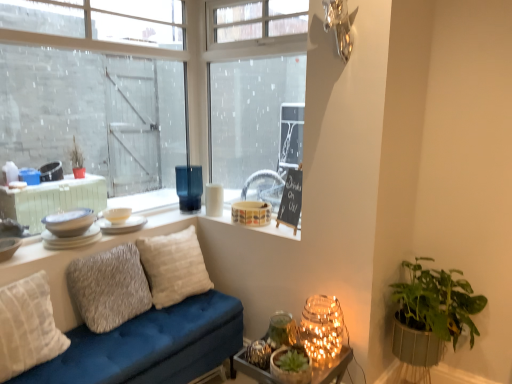
What is the approximate width of matte white plate at upper left, the second tableware viewed from the back?

matte white plate at upper left, the second tableware viewed from the back, is 25.85 centimeters wide.

In order to face textured gray pillow at center, positioned as the 2th pillow in front-to-back order, should I rotate leftwards or rightwards?

Rotate left and turn 18.569 degrees.

The image size is (512, 384). What do you see at coordinates (251, 213) in the screenshot?
I see `matte ceramic bowl at upper center, positioned as the 1th candle holder in right-to-left order` at bounding box center [251, 213].

What do you see at coordinates (214, 200) in the screenshot?
I see `white matte candle holder at upper center, the second candle holder positioned from the left` at bounding box center [214, 200].

The height and width of the screenshot is (384, 512). What do you see at coordinates (145, 100) in the screenshot?
I see `transparent glass window at upper left, arranged as the 2th window when ordered from the bottom` at bounding box center [145, 100].

You are a GUI agent. You are given a task and a screenshot of the screen. Output one action in this format:
    pyautogui.click(x=<x>, y=<y>)
    Task: Click on the matte white plate at upper left, which appears as the third tableware when viewed from the front
    Image resolution: width=512 pixels, height=384 pixels.
    Given the screenshot: What is the action you would take?
    click(x=122, y=225)

Is beige textured pillow at center, the 3th pillow from the front, wider than black chalkboard at upper center?

Correct, the width of beige textured pillow at center, the 3th pillow from the front, exceeds that of black chalkboard at upper center.

Is point (145, 247) positioned after point (283, 189)?

That is False.

How different are the orientations of beige textured pillow at center, the 3th pillow from the front, and black chalkboard at upper center in degrees?

The facing directions of beige textured pillow at center, the 3th pillow from the front, and black chalkboard at upper center are 113 degrees apart.

Is matte white plates at window sill, marked as the fourth tableware in a back-to-front arrangement, to the left or to the right of green textured pot at lower right, positioned as the first houseplant in left-to-right order, in the image?

In the image, matte white plates at window sill, marked as the fourth tableware in a back-to-front arrangement, appears on the left side of green textured pot at lower right, positioned as the first houseplant in left-to-right order.

Is matte white plates at window sill, the first tableware in the front-to-back sequence, far from green textured pot at lower right, positioned as the first houseplant in left-to-right order?

Absolutely, matte white plates at window sill, the first tableware in the front-to-back sequence, is distant from green textured pot at lower right, positioned as the first houseplant in left-to-right order.

Is matte white plates at window sill, the first tableware in the front-to-back sequence, facing towards green textured pot at lower right, the 2th houseplant when ordered from right to left?

No, matte white plates at window sill, the first tableware in the front-to-back sequence, is not facing towards green textured pot at lower right, the 2th houseplant when ordered from right to left.

Considering their positions, is matte white plates at window sill, the first tableware in the front-to-back sequence, located in front of or behind green textured pot at lower right, positioned as the first houseplant in left-to-right order?

Clearly, matte white plates at window sill, the first tableware in the front-to-back sequence, is behind green textured pot at lower right, positioned as the first houseplant in left-to-right order.

Is white glossy bowls at upper left, the 3th tableware positioned from the back, completely or partially outside of green textured pot at lower right, the 2th houseplant when ordered from right to left?

Yes, white glossy bowls at upper left, the 3th tableware positioned from the back, is located beyond the bounds of green textured pot at lower right, the 2th houseplant when ordered from right to left.

Which is behind, point (52, 246) or point (288, 372)?

The point (52, 246) is farther.

Looking at this image, is green textured pot at lower right, the 2th houseplant when ordered from right to left, at the back of white glossy bowls at upper left, which appears as the 2th tableware when viewed from the front?

white glossy bowls at upper left, which appears as the 2th tableware when viewed from the front, is not turned away from green textured pot at lower right, the 2th houseplant when ordered from right to left.

Is the surface of black chalkboard at upper center in direct contact with beige textured pillow at center, the 1th pillow when ordered from back to front?

No, black chalkboard at upper center is not next to beige textured pillow at center, the 1th pillow when ordered from back to front.

Which of these two, black chalkboard at upper center or beige textured pillow at center, the 1th pillow when ordered from back to front, stands taller?

black chalkboard at upper center is taller.

Is black chalkboard at upper center completely or partially outside of beige textured pillow at center, the 1th pillow when ordered from back to front?

black chalkboard at upper center lies outside beige textured pillow at center, the 1th pillow when ordered from back to front,'s area.

From the image's perspective, which object appears higher, black chalkboard at upper center or beige textured pillow at center, the 1th pillow when ordered from back to front?

black chalkboard at upper center.

From the image's perspective, which object appears higher, white matte bowl at upper center, the first tableware positioned from the back, or transparent glass window at upper left, arranged as the 2th window when ordered from the bottom?

transparent glass window at upper left, arranged as the 2th window when ordered from the bottom, is shown above in the image.

Is white matte bowl at upper center, the fourth tableware positioned from the front, far from transparent glass window at upper left, arranged as the 2th window when ordered from the bottom?

No.

Which object is closer to the camera, white matte bowl at upper center, the fourth tableware positioned from the front, or transparent glass window at upper left, arranged as the 1th window when viewed from the top?

transparent glass window at upper left, arranged as the 1th window when viewed from the top, is closer to the camera.

Measure the distance from white matte bowl at upper center, the first tableware positioned from the back, to transparent glass window at upper left, arranged as the 1th window when viewed from the top.

white matte bowl at upper center, the first tableware positioned from the back, is 82.97 centimeters from transparent glass window at upper left, arranged as the 1th window when viewed from the top.

Considering the sizes of objects matte white plate at upper left, which appears as the third tableware when viewed from the front, and matte ceramic bowl at upper center, marked as the 3th candle holder in a left-to-right arrangement, in the image provided, who is bigger, matte white plate at upper left, which appears as the third tableware when viewed from the front, or matte ceramic bowl at upper center, marked as the 3th candle holder in a left-to-right arrangement,?

With larger size is matte ceramic bowl at upper center, marked as the 3th candle holder in a left-to-right arrangement.

Consider the image. Does matte white plate at upper left, the second tableware viewed from the back, lie in front of matte ceramic bowl at upper center, marked as the 3th candle holder in a left-to-right arrangement?

Yes, it is.

At what (x,y) coordinates should I click in order to perform the action: click on the 1st tableware counting from the left of the matte ceramic bowl at upper center, marked as the 3th candle holder in a left-to-right arrangement. Please return your answer as a coordinate pair (x, y). The height and width of the screenshot is (384, 512). Looking at the image, I should click on tap(122, 225).

Is there a large distance between matte white plate at upper left, which appears as the third tableware when viewed from the front, and matte ceramic bowl at upper center, positioned as the 1th candle holder in right-to-left order?

That's not correct — matte white plate at upper left, which appears as the third tableware when viewed from the front, is a little close to matte ceramic bowl at upper center, positioned as the 1th candle holder in right-to-left order.

Is translucent glass vase at window, placed as the 1th candle holder when sorted from left to right, surrounded by white matte bowl at upper center, the fourth tableware positioned from the front?

No.

Based on the photo, considering the relative sizes of white matte bowl at upper center, the first tableware positioned from the back, and translucent glass vase at window, placed as the 1th candle holder when sorted from left to right, in the image provided, is white matte bowl at upper center, the first tableware positioned from the back, thinner than translucent glass vase at window, placed as the 1th candle holder when sorted from left to right,?

No, white matte bowl at upper center, the first tableware positioned from the back, is not thinner than translucent glass vase at window, placed as the 1th candle holder when sorted from left to right.

Considering the sizes of objects white matte bowl at upper center, the first tableware positioned from the back, and translucent glass vase at window, placed as the 1th candle holder when sorted from left to right, in the image provided, who is shorter, white matte bowl at upper center, the first tableware positioned from the back, or translucent glass vase at window, placed as the 1th candle holder when sorted from left to right,?

white matte bowl at upper center, the first tableware positioned from the back.

Which is behind, point (127, 213) or point (182, 183)?

The point (182, 183) is farther.

From the image's perspective, starting from the black chalkboard at upper center, which pillow is the 1st one below? Please provide its 2D coordinates.

[(173, 267)]

Identify the location of the 2nd houseplant in front of the matte white plates at window sill, marked as the fourth tableware in a back-to-front arrangement. (290, 366).

Which object lies further to the anchor point matte white plates at window sill, marked as the fourth tableware in a back-to-front arrangement, white ceramic dishes at upper left, the first window positioned from the bottom, or white matte bowl at upper center, the fourth tableware positioned from the front?

white ceramic dishes at upper left, the first window positioned from the bottom, lies further to matte white plates at window sill, marked as the fourth tableware in a back-to-front arrangement, than the other object.

Which object lies further to the anchor point textured gray pillow at center, marked as the 2th pillow in a back-to-front arrangement, green textured pot at lower right, positioned as the first houseplant in left-to-right order, or matte white plates at window sill, marked as the fourth tableware in a back-to-front arrangement?

Among the two, green textured pot at lower right, positioned as the first houseplant in left-to-right order, is located further to textured gray pillow at center, marked as the 2th pillow in a back-to-front arrangement.

From the image, which object appears to be farther from transparent glass window at upper left, arranged as the 1th window when viewed from the top, matte white plate at upper left, which appears as the third tableware when viewed from the front, or matte ceramic bowl at upper center, positioned as the 1th candle holder in right-to-left order?

matte ceramic bowl at upper center, positioned as the 1th candle holder in right-to-left order, lies further to transparent glass window at upper left, arranged as the 1th window when viewed from the top, than the other object.

From the image, which object appears to be farther from textured gray pillow at center, marked as the 2th pillow in a back-to-front arrangement, white matte candle holder at upper center, the second candle holder positioned from the left, or beige textured pillow at center, the 1th pillow when ordered from back to front?

white matte candle holder at upper center, the second candle holder positioned from the left, is further to textured gray pillow at center, marked as the 2th pillow in a back-to-front arrangement.

Based on their spatial positions, is green textured pot at lower right, positioned as the first houseplant in left-to-right order, or white matte bowl at upper center, the first tableware positioned from the back, further from illuminated glass jar at lower right, arranged as the 1th table when viewed from the top?

white matte bowl at upper center, the first tableware positioned from the back.

From the image, which object appears to be farther from black chalkboard at upper center, white ceramic dishes at upper left, the 2th window positioned from the top, or transparent glass window at upper left, arranged as the 1th window when viewed from the top?

transparent glass window at upper left, arranged as the 1th window when viewed from the top, lies further to black chalkboard at upper center than the other object.

Looking at the image, which one is located closer to matte white plate at upper left, the second tableware viewed from the back, transparent glass window at upper left, arranged as the 2th window when ordered from the bottom, or white ceramic dishes at upper left, the first window positioned from the bottom?

Based on the image, white ceramic dishes at upper left, the first window positioned from the bottom, appears to be nearer to matte white plate at upper left, the second tableware viewed from the back.

Estimate the real-world distances between objects in this image. Which object is closer to translucent glass candle holder at lower right, which ranks as the second table in top-to-bottom order, white textured pillow at left, the third pillow when ordered from back to front, or matte white plate at upper left, which appears as the third tableware when viewed from the front?

Among the two, white textured pillow at left, the third pillow when ordered from back to front, is located nearer to translucent glass candle holder at lower right, which ranks as the second table in top-to-bottom order.

This screenshot has height=384, width=512. I want to click on bulletin board between textured gray pillow at center, marked as the 2th pillow in a back-to-front arrangement, and illuminated glass jar at lower right, the 2th table in the bottom-to-top sequence, so [291, 200].

Where is `bulletin board between white ceramic dishes at upper left, the first window positioned from the bottom, and illuminated glass jar at lower right, arranged as the 1th table when viewed from the top, in the horizontal direction`? bulletin board between white ceramic dishes at upper left, the first window positioned from the bottom, and illuminated glass jar at lower right, arranged as the 1th table when viewed from the top, in the horizontal direction is located at coordinates (291, 200).

The width and height of the screenshot is (512, 384). In order to click on tableware between white matte bowl at upper center, the fourth tableware positioned from the front, and illuminated glass jar at lower right, the 2th table in the bottom-to-top sequence, from left to right in this screenshot , I will do `click(122, 225)`.

This screenshot has width=512, height=384. Find the location of `table between white ceramic dishes at upper left, the first window positioned from the bottom, and illuminated glass jar at lower right, arranged as the 1th table when viewed from the top`. table between white ceramic dishes at upper left, the first window positioned from the bottom, and illuminated glass jar at lower right, arranged as the 1th table when viewed from the top is located at coordinates (334, 368).